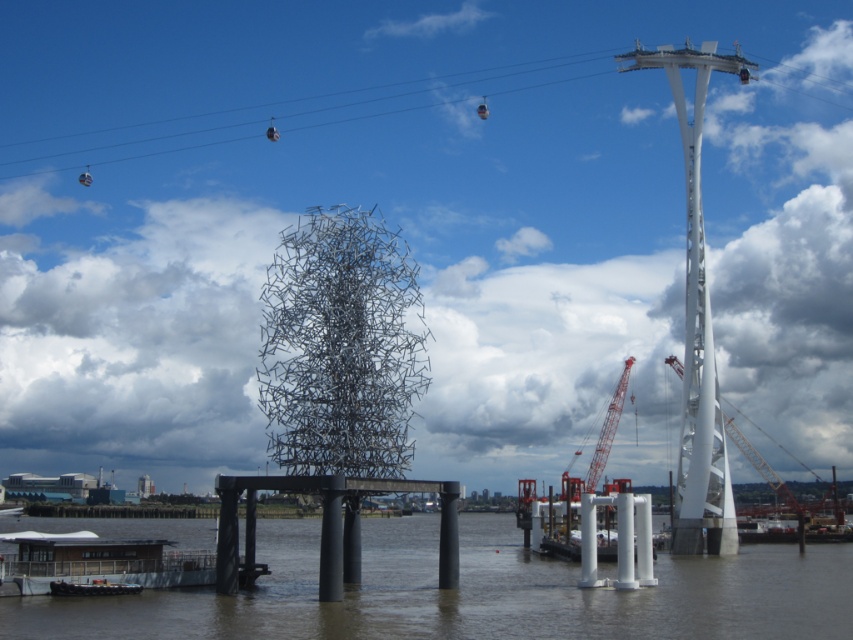
You are a photographer trying to capture the sculpture and the cable car in a single shot. Based on the scene, which object, the brown murky water at center or the metallic cable car at upper center, is positioned higher in the frame?

The metallic cable car at upper center is positioned higher in the frame than the brown murky water at center.

In the scene shown: You are standing on the dock and want to reach the metallic gray boat at lower left. Which direction should you move in relation to the brown murky water at center?

You should move to the left of the brown murky water at center to reach the metallic gray boat at lower left since the brown murky water at center is to the right of the metallic gray boat at lower left.

You are a tourist standing at the waterfront and want to take a photo of both the metallic cable car at upper center and the white metallic crane at center right. However, you notice that one of them is blocking the view of the other. Which object is blocking the view of the other?

The white metallic crane at center right is behind the metallic cable car at upper center, so the metallic cable car at upper center is blocking the view of the white metallic crane at center right.